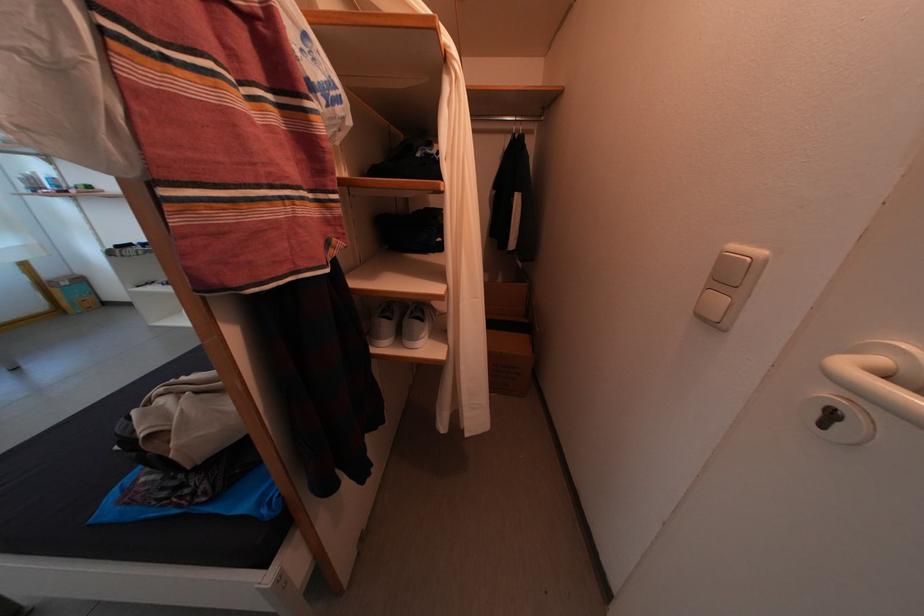
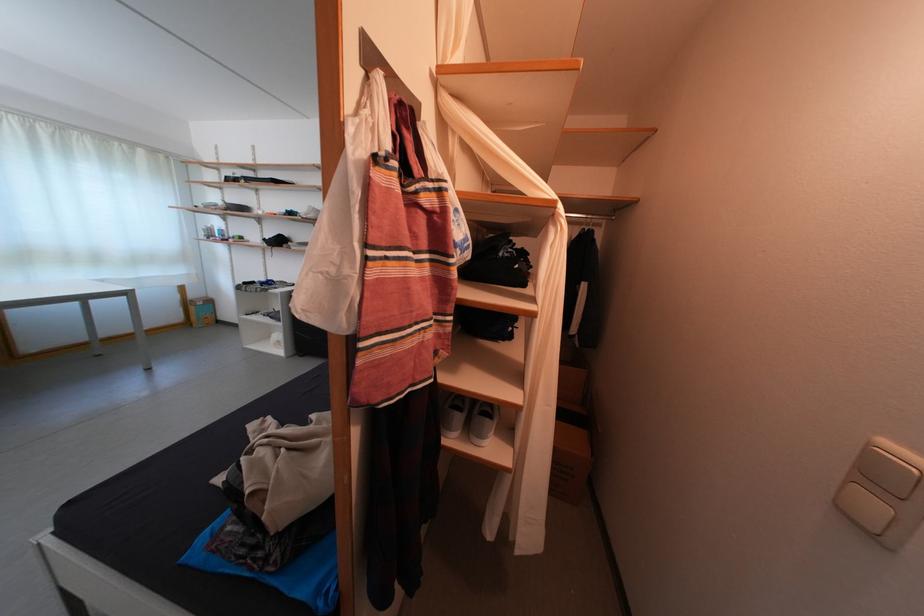
Question: The first image is from the beginning of the video and the second image is from the end. How did the camera likely rotate when shooting the video?

Choices:
 (A) Left
 (B) Right
 (C) Up
 (D) Down

Answer: (C)